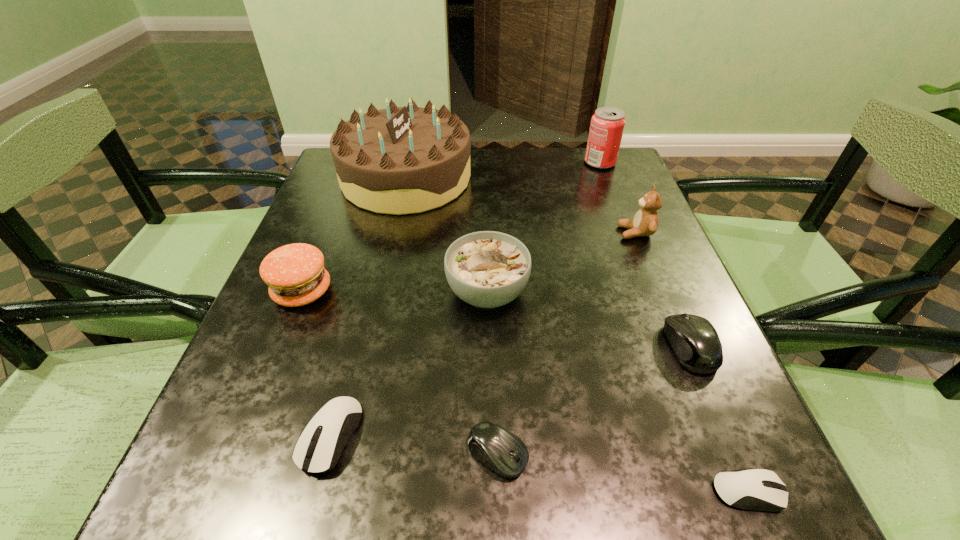
This screenshot has height=540, width=960. I want to click on vacant space located 0.200m on the right of the white soup bowl, so click(633, 292).

Where is `vacant area situated on the back of the patty`? This screenshot has width=960, height=540. vacant area situated on the back of the patty is located at coordinates (332, 218).

At what (x,y) coordinates should I click in order to perform the action: click on free spot located on the front of the right black mouse. Please return your answer as a coordinate pair (x, y). Looking at the image, I should click on (742, 471).

Where is `vacant space located 0.060m on the left of the left white mouse`? vacant space located 0.060m on the left of the left white mouse is located at coordinates (260, 436).

Locate an element on the screen. This screenshot has width=960, height=540. free space located on the back of the smaller black mouse is located at coordinates (492, 284).

Find the location of a particular element. The height and width of the screenshot is (540, 960). vacant space situated on the back of the shortest mouse is located at coordinates (701, 379).

At what (x,y) coordinates should I click in order to perform the action: click on birthday cake positioned at the far edge. Please return your answer as a coordinate pair (x, y). This screenshot has height=540, width=960. Looking at the image, I should click on (400, 160).

Image resolution: width=960 pixels, height=540 pixels. I want to click on soda can that is positioned at the far edge, so click(607, 125).

At what (x,y) coordinates should I click in order to perform the action: click on birthday cake that is at the left edge. Please return your answer as a coordinate pair (x, y). The height and width of the screenshot is (540, 960). Looking at the image, I should click on (400, 160).

Locate an element on the screen. patty that is at the left edge is located at coordinates (295, 274).